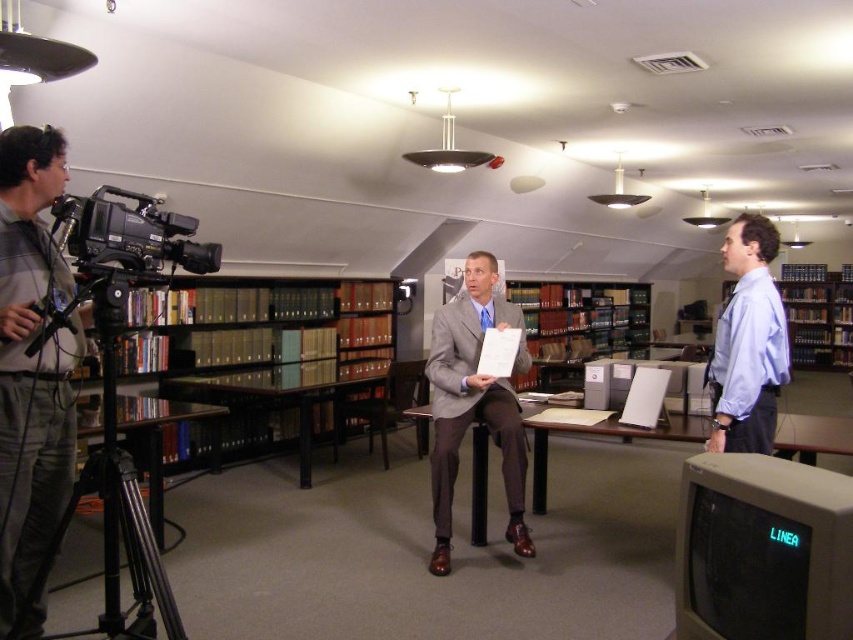
Which of these two, brown wooden bookcase at center or black metal table at center, stands shorter?

With less height is black metal table at center.

Which is below, brown wooden bookcase at center or black metal table at center?

→ black metal table at center is lower down.

Identify the location of brown wooden bookcase at center. (281, 356).

I want to click on brown wooden bookcase at center, so click(281, 356).

Between light blue shirt at right and black plastic video camera at left, which one appears on the left side from the viewer's perspective?

Positioned to the left is black plastic video camera at left.

Between light blue shirt at right and black plastic video camera at left, which one is positioned lower?

Positioned lower is light blue shirt at right.

Which is behind, point (764, 442) or point (177, 257)?

The point (764, 442) is behind.

Find the location of a particular element. The width and height of the screenshot is (853, 640). light blue shirt at right is located at coordinates (747, 342).

Between black plastic video camera at left and wooden desk at center, which one appears on the right side from the viewer's perspective?

From the viewer's perspective, wooden desk at center appears more on the right side.

Does black plastic video camera at left come in front of wooden desk at center?

Yes, black plastic video camera at left is closer to the viewer.

Which is in front, point (97, 209) or point (793, 420)?

Positioned in front is point (97, 209).

This screenshot has height=640, width=853. In order to click on black plastic video camera at left in this screenshot , I will do `click(128, 236)`.